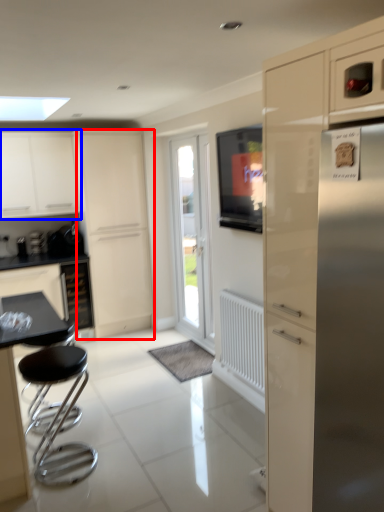
Question: Which point is further to the camera, screen door (highlighted by a red box) or cabinetry (highlighted by a blue box)?

Choices:
 (A) screen door
 (B) cabinetry

Answer: (A)